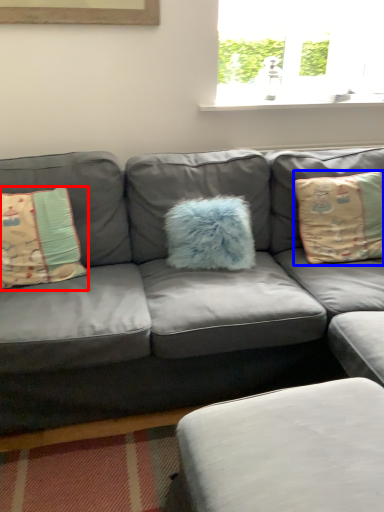
Question: Which object appears farthest to the camera in this image, pillow (highlighted by a red box) or pillow (highlighted by a blue box)?

Choices:
 (A) pillow
 (B) pillow

Answer: (B)